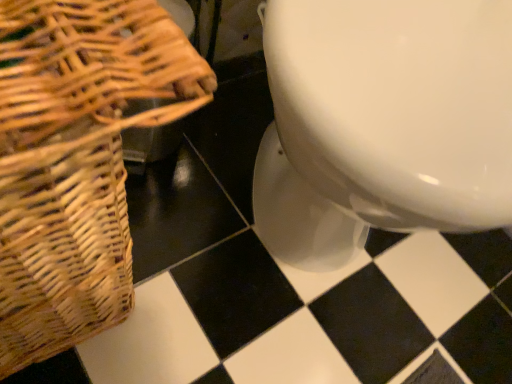
Question: Considering their positions, is white glossy toilet at center located in front of or behind woven brown picnic basket at left?

Choices:
 (A) front
 (B) behind

Answer: (B)

Question: In terms of size, does white glossy toilet at center appear bigger or smaller than woven brown picnic basket at left?

Choices:
 (A) small
 (B) big

Answer: (B)

Question: Visually, is white glossy toilet at center positioned to the left or to the right of woven brown picnic basket at left?

Choices:
 (A) right
 (B) left

Answer: (A)

Question: In the image, is woven brown picnic basket at left positioned in front of or behind white glossy toilet at center?

Choices:
 (A) front
 (B) behind

Answer: (A)

Question: Considering the positions of woven brown picnic basket at left and white glossy toilet at center in the image, is woven brown picnic basket at left wider or thinner than white glossy toilet at center?

Choices:
 (A) wide
 (B) thin

Answer: (B)

Question: Is point (31, 261) positioned closer to the camera than point (352, 226)?

Choices:
 (A) farther
 (B) closer

Answer: (B)

Question: Would you say woven brown picnic basket at left is to the left or to the right of white glossy toilet at center in the picture?

Choices:
 (A) right
 (B) left

Answer: (B)